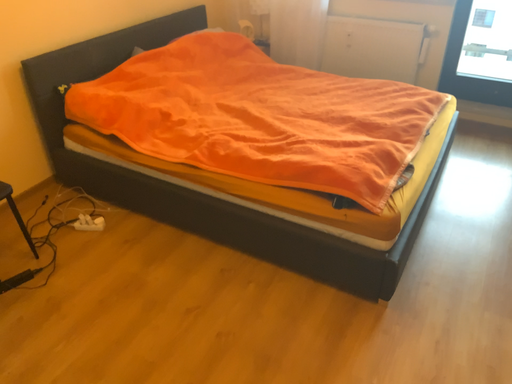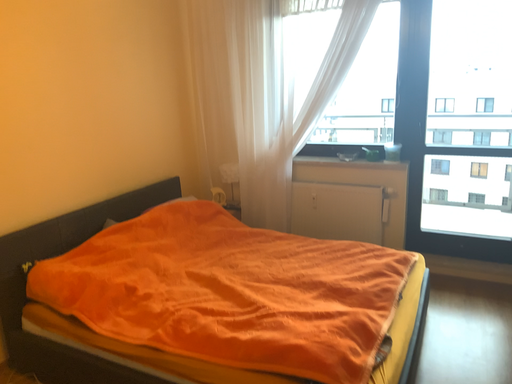
Question: Which way did the camera rotate in the video?

Choices:
 (A) rotated downward
 (B) rotated upward

Answer: (B)